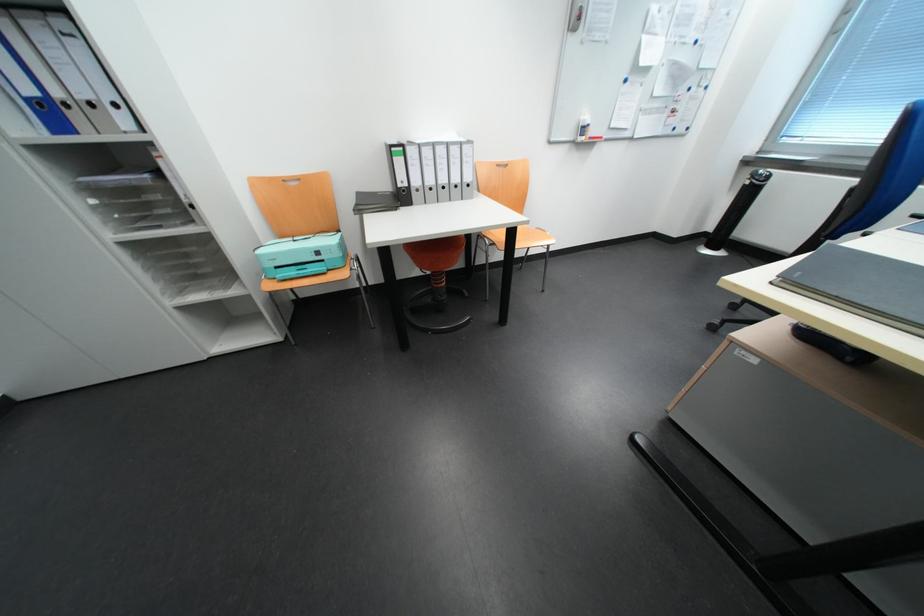
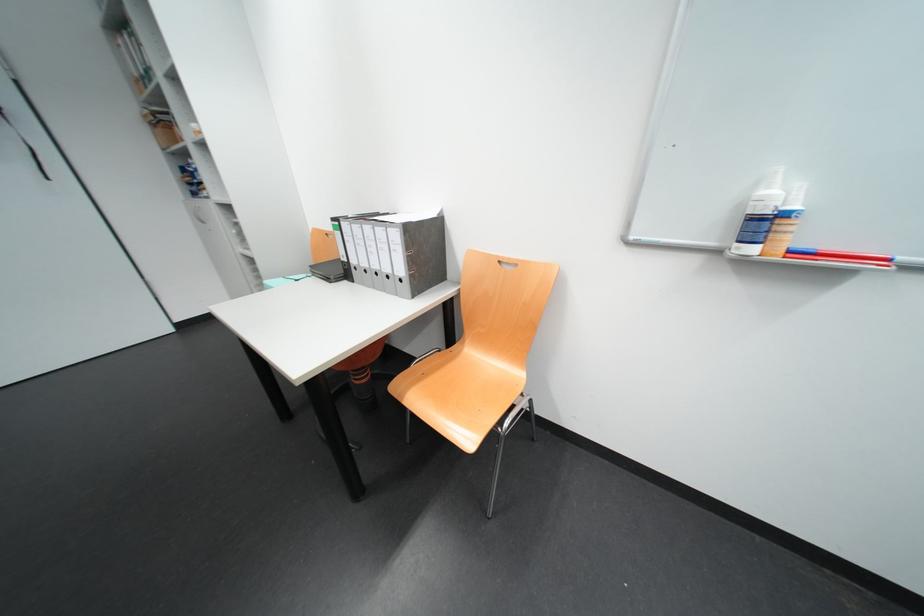
Find the pixel in the second image that matches point (418, 185) in the first image.

(358, 262)